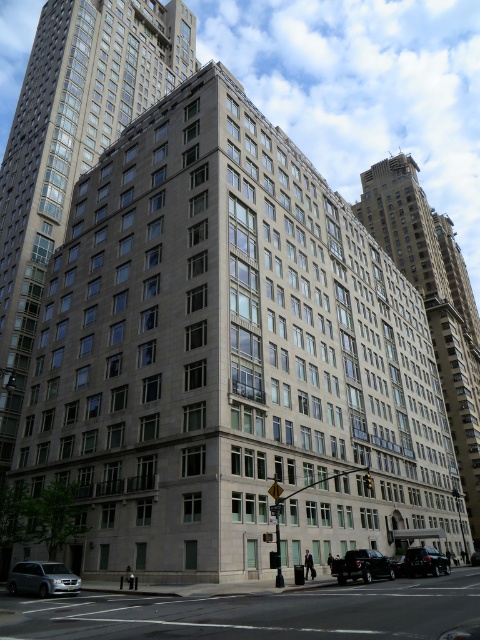
You are a delivery driver trying to park your vehicle in a tight space between two cars. You see a shiny black car at lower right and a shiny black sedan at center. Which vehicle should you avoid if you need to park in a spot that requires a lower height clearance?

You should avoid the shiny black sedan at center because it has a greater height compared to the shiny black car at lower right, which is shorter. Since the sedan is taller, the parking spot might not accommodate its height, whereas the car at lower right is shorter and more likely to fit under the clearance.

You are a pedestrian standing on the sidewalk and want to cross the street to reach the shiny black car at lower right and the shiny black sedan at center. Which vehicle should you approach first to get to the closer one?

You should approach the shiny black car at lower right first because it is closer to you than the shiny black sedan at center.